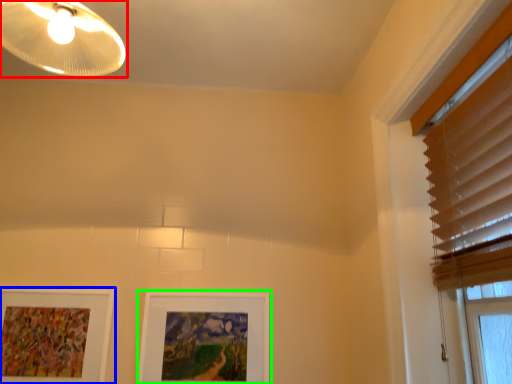
Question: Based on their relative distances, which object is farther from lamp (highlighted by a red box)? Choose from picture frame (highlighted by a blue box) and picture frame (highlighted by a green box).

Choices:
 (A) picture frame
 (B) picture frame

Answer: (B)